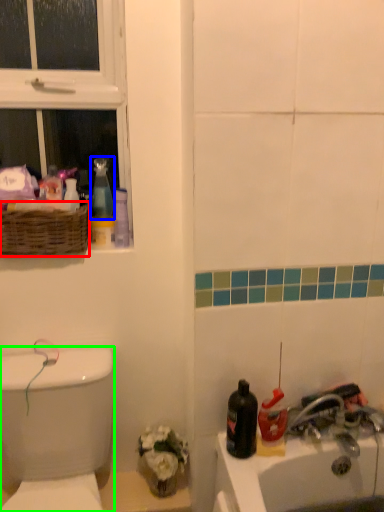
Question: Which is farther away from basket (highlighted by a red box)? cleaning product (highlighted by a blue box) or porcelain (highlighted by a green box)?

Choices:
 (A) cleaning product
 (B) porcelain

Answer: (B)